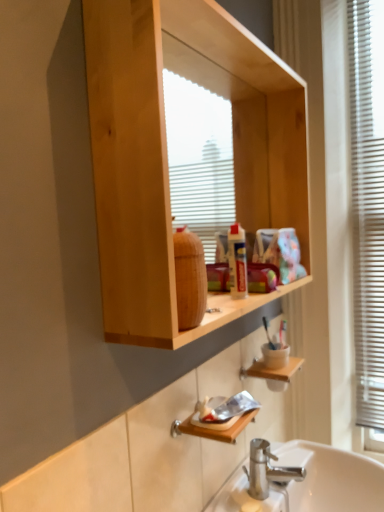
Question: Is natural wood cabinet at upper center in front of or behind wooden shelf at lower center in the image?

Choices:
 (A) front
 (B) behind

Answer: (A)

Question: Is natural wood cabinet at upper center bigger or smaller than wooden shelf at lower center?

Choices:
 (A) small
 (B) big

Answer: (B)

Question: Based on their relative distances, which object is nearer to the natural wood cabinet at upper center?

Choices:
 (A) white plastic blinds at right
 (B) wooden shelf at lower center

Answer: (A)

Question: Which object is positioned closest to the white plastic blinds at right?

Choices:
 (A) wooden shelf at lower center
 (B) natural wood cabinet at upper center

Answer: (B)